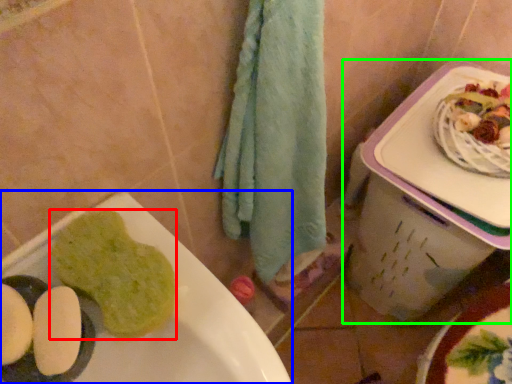
Question: Based on their relative distances, which object is nearer to food (highlighted by a red box)? Choose from sink (highlighted by a blue box) and lunch box (highlighted by a green box).

Choices:
 (A) sink
 (B) lunch box

Answer: (A)